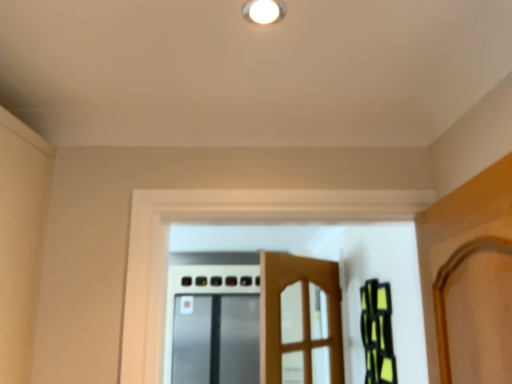
Question: Should I look upward or downward to see wooden door at center?

Choices:
 (A) down
 (B) up

Answer: (A)

Question: Is wooden door at center at the right side of white glossy light fixture at upper center?

Choices:
 (A) yes
 (B) no

Answer: (A)

Question: Is wooden door at center placed right next to white glossy light fixture at upper center?

Choices:
 (A) yes
 (B) no

Answer: (B)

Question: Considering the relative sizes of wooden door at center and white glossy light fixture at upper center in the image provided, is wooden door at center smaller than white glossy light fixture at upper center?

Choices:
 (A) yes
 (B) no

Answer: (B)

Question: From the image's perspective, is wooden door at center below white glossy light fixture at upper center?

Choices:
 (A) no
 (B) yes

Answer: (B)

Question: Is wooden door at center completely or partially outside of white glossy light fixture at upper center?

Choices:
 (A) no
 (B) yes

Answer: (B)

Question: Is wooden door at center far away from white glossy light fixture at upper center?

Choices:
 (A) no
 (B) yes

Answer: (B)

Question: Are white glossy light fixture at upper center and wooden door at center far apart?

Choices:
 (A) yes
 (B) no

Answer: (A)

Question: Is white glossy light fixture at upper center surrounding wooden door at center?

Choices:
 (A) no
 (B) yes

Answer: (A)

Question: From the image's perspective, is white glossy light fixture at upper center below wooden door at center?

Choices:
 (A) yes
 (B) no

Answer: (B)

Question: Can you confirm if white glossy light fixture at upper center is positioned to the right of wooden door at center?

Choices:
 (A) yes
 (B) no

Answer: (B)

Question: Is white glossy light fixture at upper center wider than wooden door at center?

Choices:
 (A) yes
 (B) no

Answer: (B)

Question: Is white glossy light fixture at upper center at the left side of wooden door at center?

Choices:
 (A) yes
 (B) no

Answer: (A)

Question: Is the depth of white glossy light fixture at upper center greater than that of satin silver screen door at center?

Choices:
 (A) no
 (B) yes

Answer: (A)